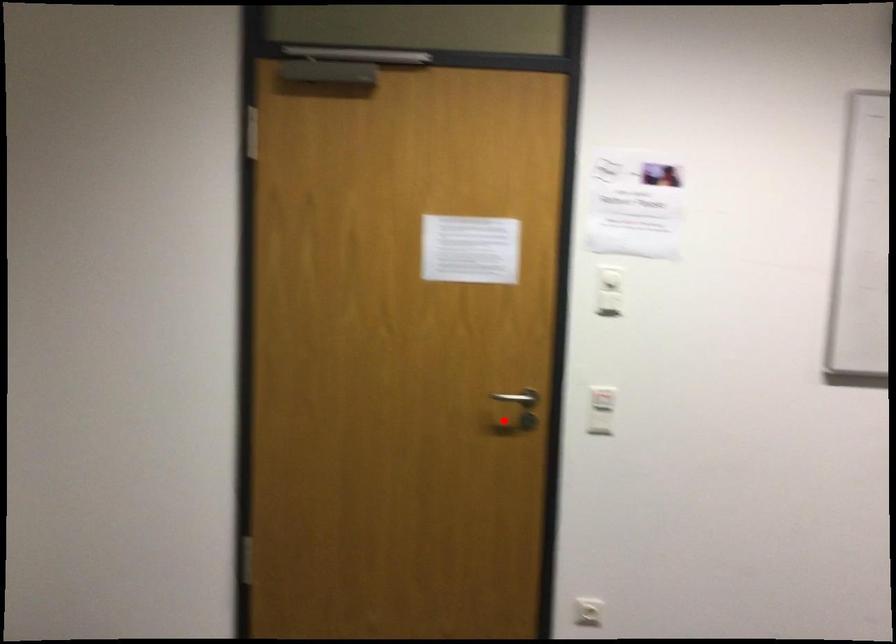
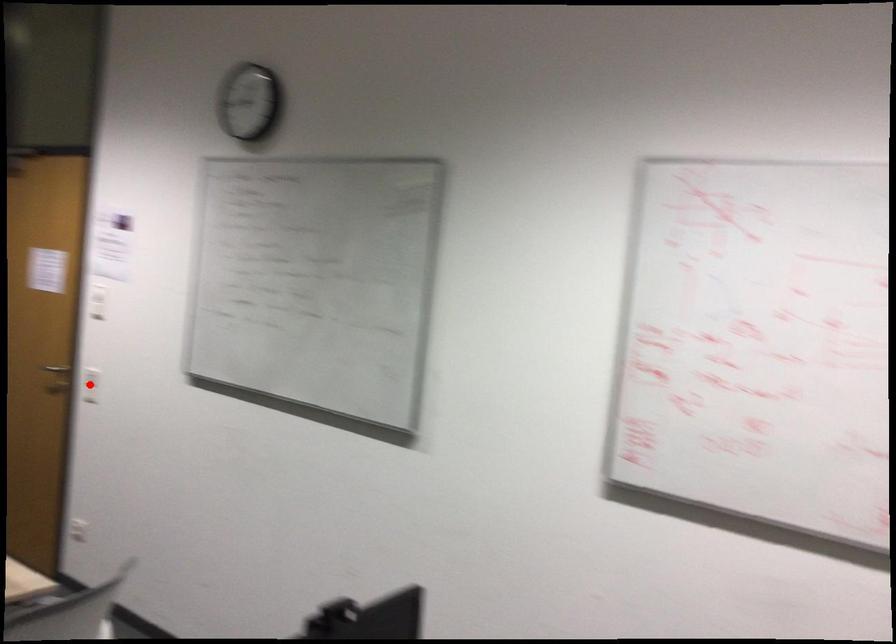
I am providing you with two images of the same scene from different viewpoints. A red point is marked on the first image and another point is marked on the second image. Is the red point in image1 aligned with the point shown in image2?

Yes